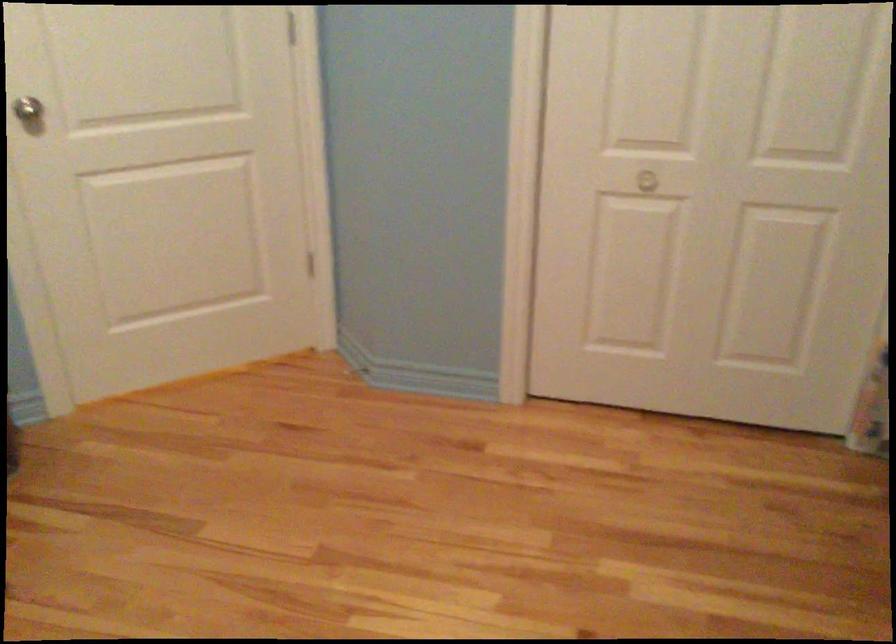
Find the location of `silver door knob`. silver door knob is located at coordinates (29, 111).